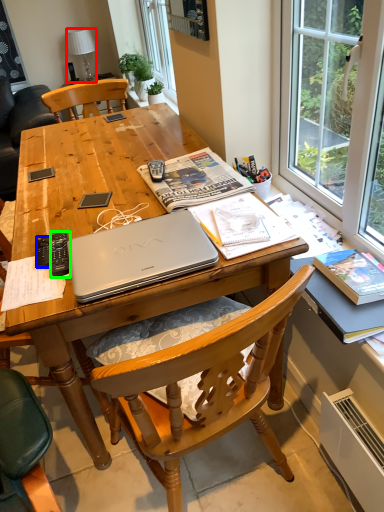
Question: Which object is the farthest from lamp (highlighted by a red box)? Choose among these: remote control (highlighted by a blue box) or remote control (highlighted by a green box).

Choices:
 (A) remote control
 (B) remote control

Answer: (A)